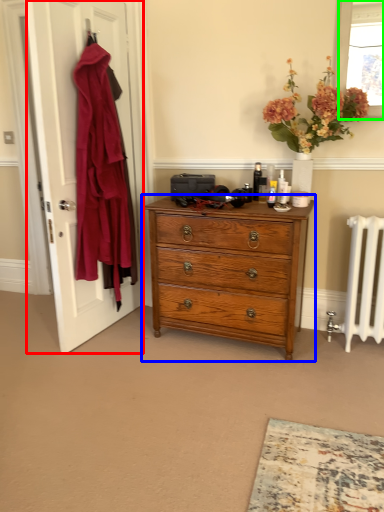
Question: Estimate the real-world distances between objects in this image. Which object is closer to door (highlighted by a red box), chest of drawers (highlighted by a blue box) or window screen (highlighted by a green box)?

Choices:
 (A) chest of drawers
 (B) window screen

Answer: (A)